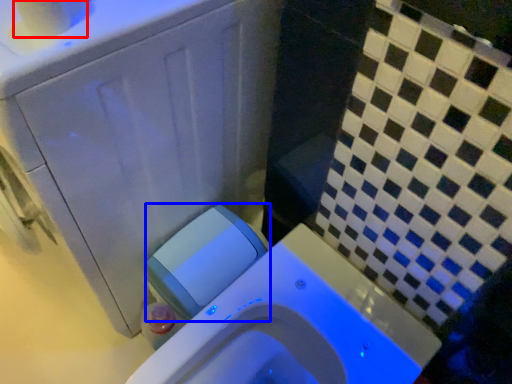
Question: Among these objects, which one is nearest to the camera, toilet paper (highlighted by a red box) or water tank (highlighted by a blue box)?

Choices:
 (A) toilet paper
 (B) water tank

Answer: (A)